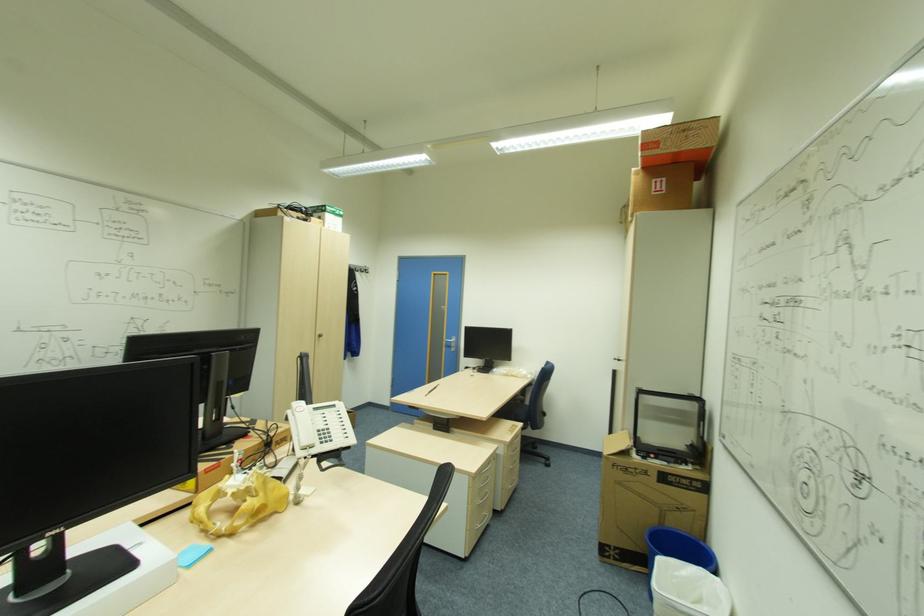
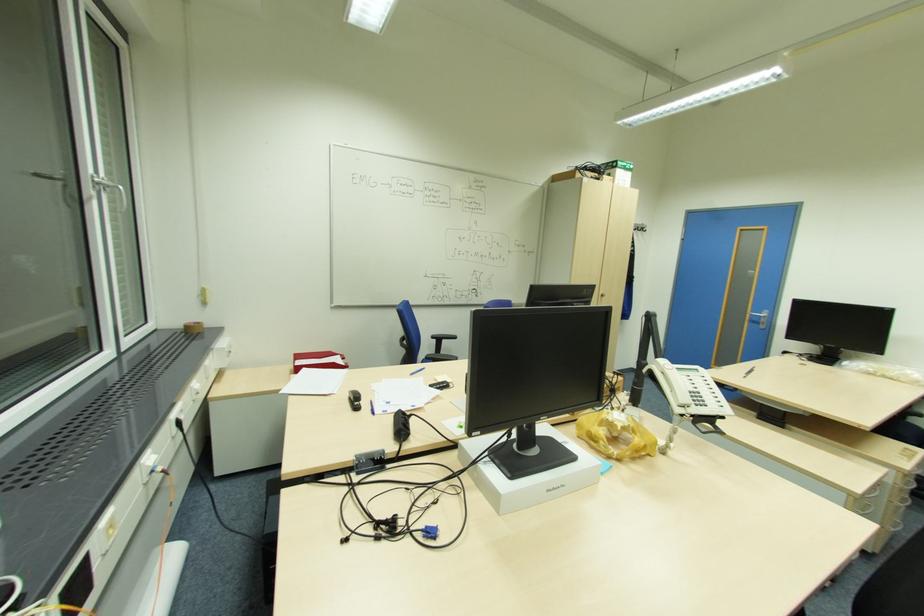
In the second image, find the point that corresponds to (x=456, y=346) in the first image.

(766, 323)